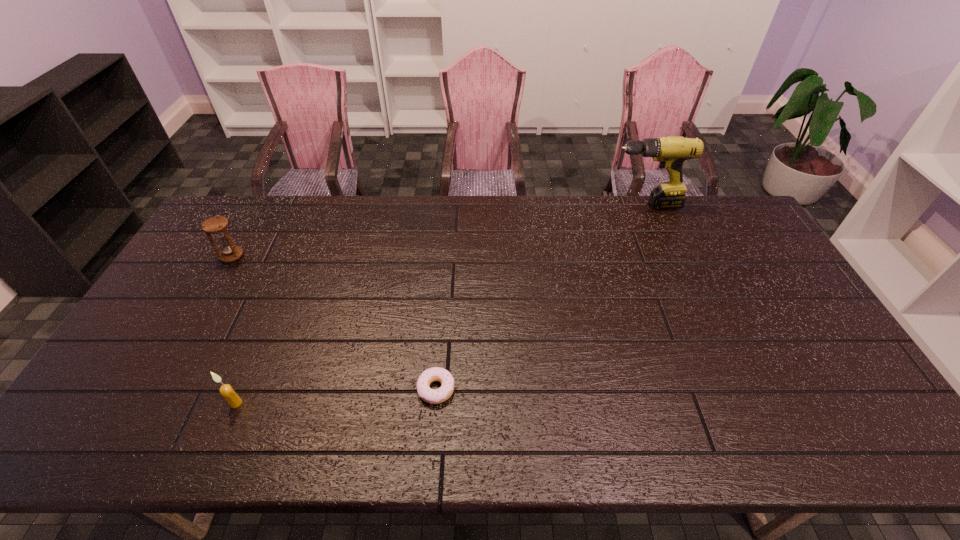
Where is `vacant point located between the third object from right to left and the third object from left to right`? The image size is (960, 540). vacant point located between the third object from right to left and the third object from left to right is located at coordinates (336, 396).

The image size is (960, 540). What are the coordinates of `blank region between the leftmost object and the doughnut` in the screenshot? It's located at (334, 322).

Where is `free space between the tallest object and the second farthest object`? free space between the tallest object and the second farthest object is located at coordinates click(438, 231).

Locate an element on the screen. Image resolution: width=960 pixels, height=540 pixels. vacant point located between the third nearest object and the second object from right to left is located at coordinates (334, 322).

Locate an element on the screen. This screenshot has width=960, height=540. free space between the drill and the doughnut is located at coordinates point(540,297).

Locate an element on the screen. free space between the drill and the shortest object is located at coordinates (540, 297).

Locate an element on the screen. The image size is (960, 540). vacant space in between the third object from right to left and the rightmost object is located at coordinates (440, 304).

I want to click on unoccupied area between the shortest object and the candle, so click(x=336, y=396).

I want to click on free space that is in between the leftmost object and the drill, so click(x=438, y=231).

The width and height of the screenshot is (960, 540). Find the location of `the second closest object to the shortest object`. the second closest object to the shortest object is located at coordinates (217, 226).